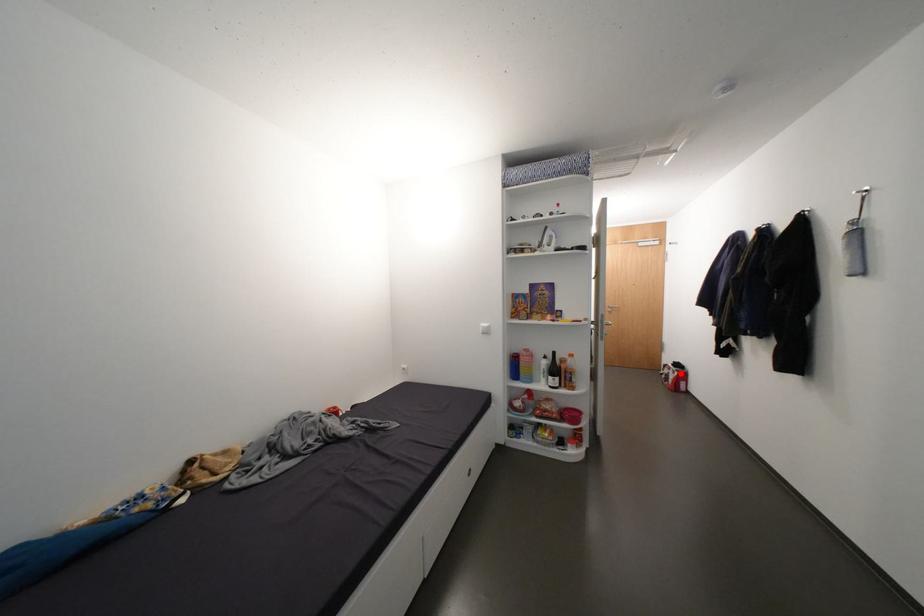
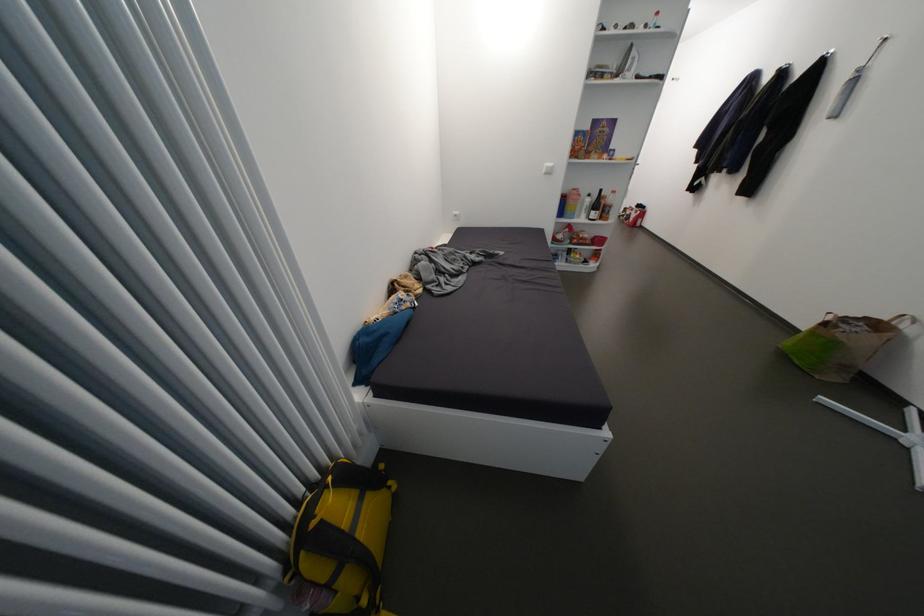
Question: A red point is marked in image1. In image2, is the corresponding 3D point closer to the camera or farther? Reply with the corresponding letter.

Choices:
 (A) The corresponding 3D point is closer.
 (B) The corresponding 3D point is farther.

Answer: (B)